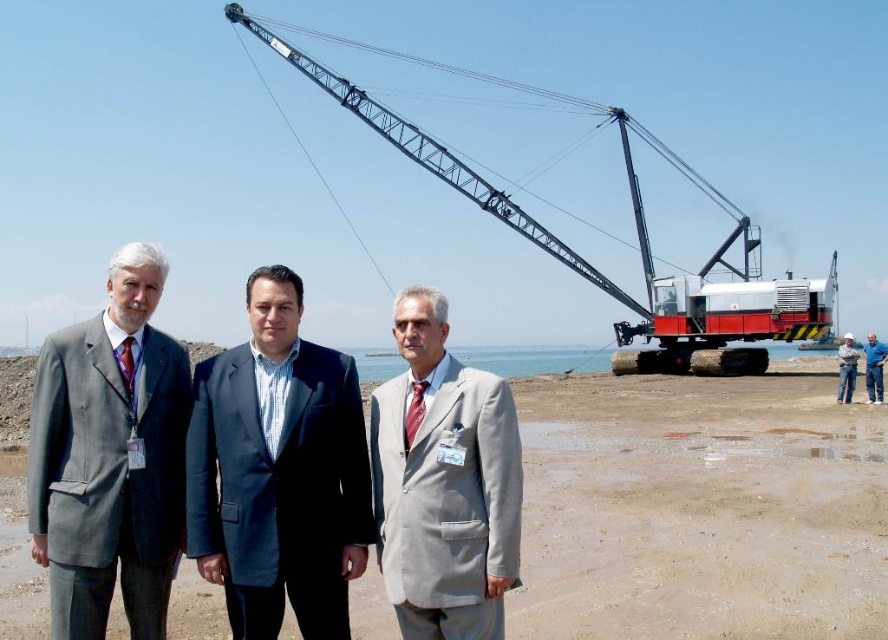
Between brown sand at lower center and metallic gray crane at upper center, which one is positioned higher?

metallic gray crane at upper center is higher up.

Is brown sand at lower center behind metallic gray crane at upper center?

No, brown sand at lower center is closer to the viewer.

Between point (724, 577) and point (414, 128), which one is positioned in front?

Point (724, 577) is in front.

Identify the location of brown sand at lower center. The width and height of the screenshot is (888, 640). (700, 508).

What do you see at coordinates (724, 323) in the screenshot? I see `red matte trailer truck at center` at bounding box center [724, 323].

Who is more forward, (746, 326) or (879, 369)?

Point (879, 369) is in front.

The width and height of the screenshot is (888, 640). I want to click on red matte trailer truck at center, so 724,323.

Between point (188, 424) and point (871, 365), which one is positioned behind?

The point (871, 365) is behind.

Can you confirm if dark blue suit at center is smaller than blue fabric shirt at right?

Correct, dark blue suit at center occupies less space than blue fabric shirt at right.

Does point (231, 509) lie behind point (882, 342)?

No, (231, 509) is in front of (882, 342).

Identify the location of dark blue suit at center. (278, 472).